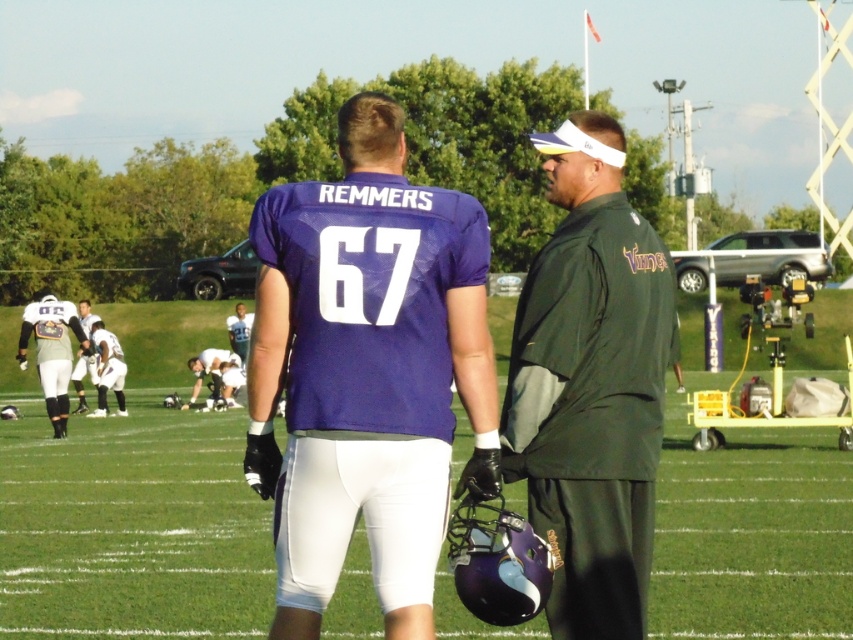
You are standing at the point marked as point (107, 369) in the image. What object is exactly at this point?

The white matte uniform at lower left is located at point (107, 369).

You are a photographer trying to capture a group photo of the purple fabric uniform at center and the white uniform at left. Since you want both subjects to be in the frame, which direction should you move the camera to include both?

The purple fabric uniform at center is to the right of white uniform at left. To include both in the frame, move the camera to the right to capture the purple fabric uniform at center and left to capture the white uniform at left, ensuring both are centered.

You are a coach who needs to quickly pass a ball from the purple fabric uniform at center to the white uniform at lower left. Given that the distance between them is 23.67 meters, can you estimate if a standard football throw would reach them without bouncing?

The purple fabric uniform at center and white uniform at lower left are 23.67 meters apart. A standard football throw can typically reach up to around 20 meters, so the distance is too far for a standard throw without bouncing. The ball would likely need to bounce or require a stronger throw.